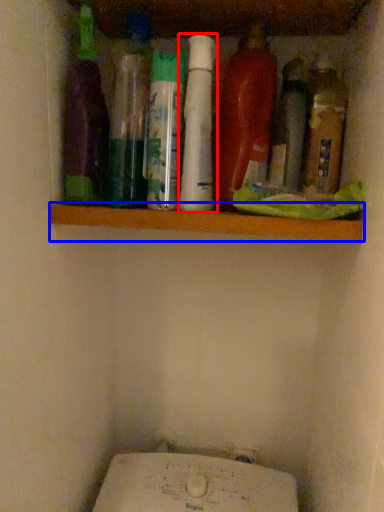
Question: Which object appears farthest to the camera in this image, bottle (highlighted by a red box) or ledge (highlighted by a blue box)?

Choices:
 (A) bottle
 (B) ledge

Answer: (B)